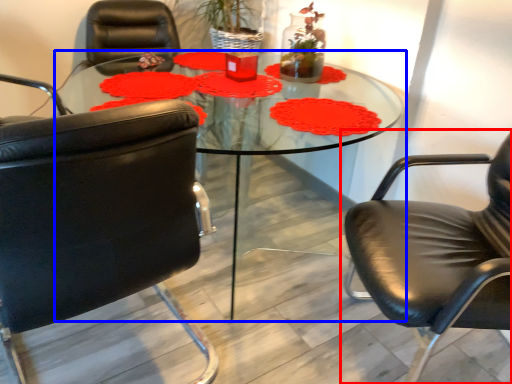
Question: Which point is closer to the camera, chair (highlighted by a red box) or coffee table (highlighted by a blue box)?

Choices:
 (A) chair
 (B) coffee table

Answer: (A)